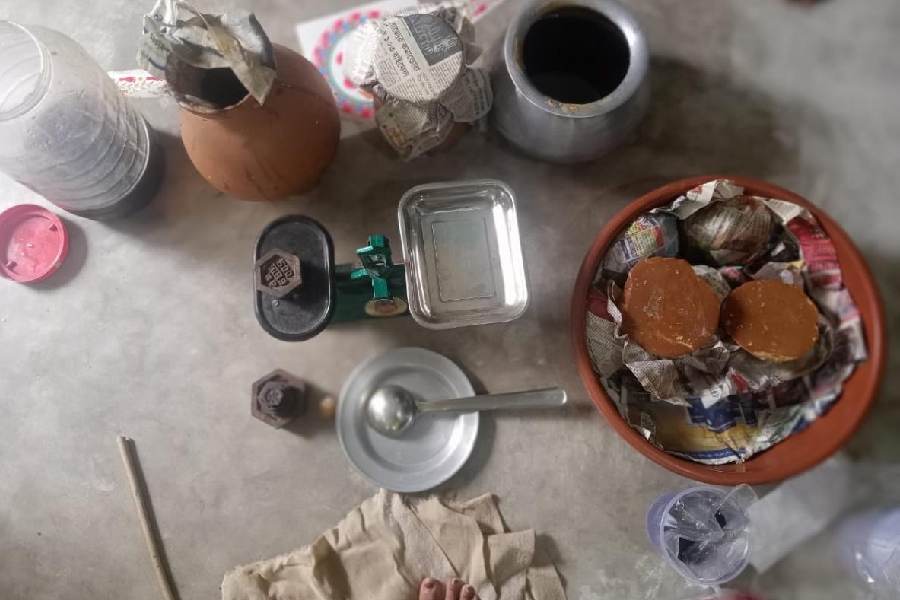
The image size is (900, 600). In order to click on pots in this screenshot , I will do `click(254, 126)`, `click(446, 142)`.